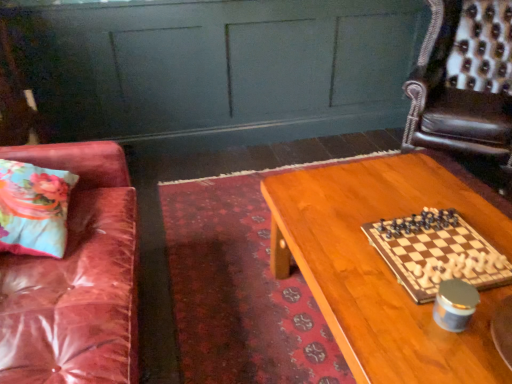
Find the location of `empty space that is ontop of matte green dresser at upper center (from a real-world perspective)`. empty space that is ontop of matte green dresser at upper center (from a real-world perspective) is located at coordinates (133, 4).